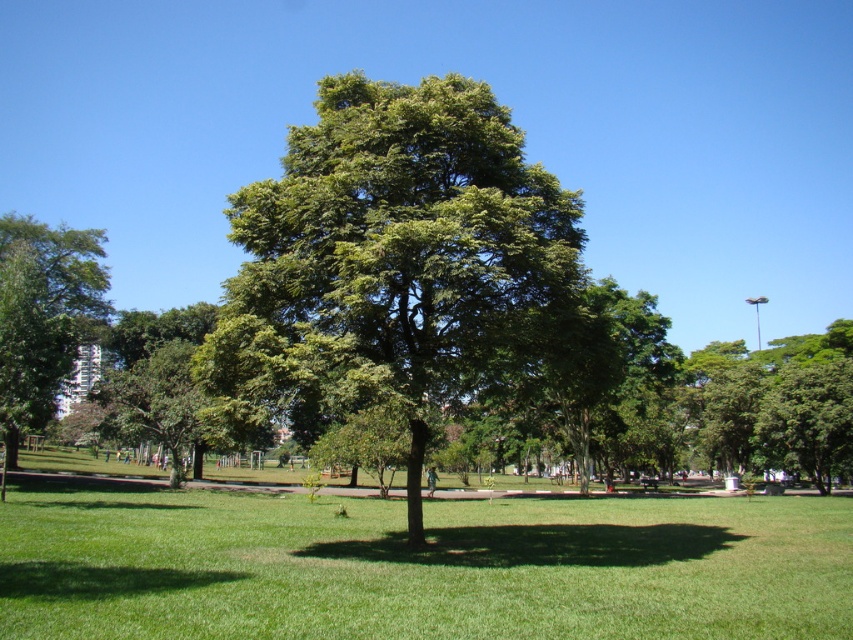
You are planning to plant a new tree in the park. The new tree will grow to be the same size as the green leafy tree at center. If you want to ensure there is enough space between the new tree and the green leafy tree at left, which currently is the larger one, where should you plant the new tree?

The green leafy tree at center is smaller than the green leafy tree at left. Since the new tree will grow to be the same size as the green leafy tree at center, you should plant it away from the green leafy tree at left to maintain sufficient spacing between them as they grow.